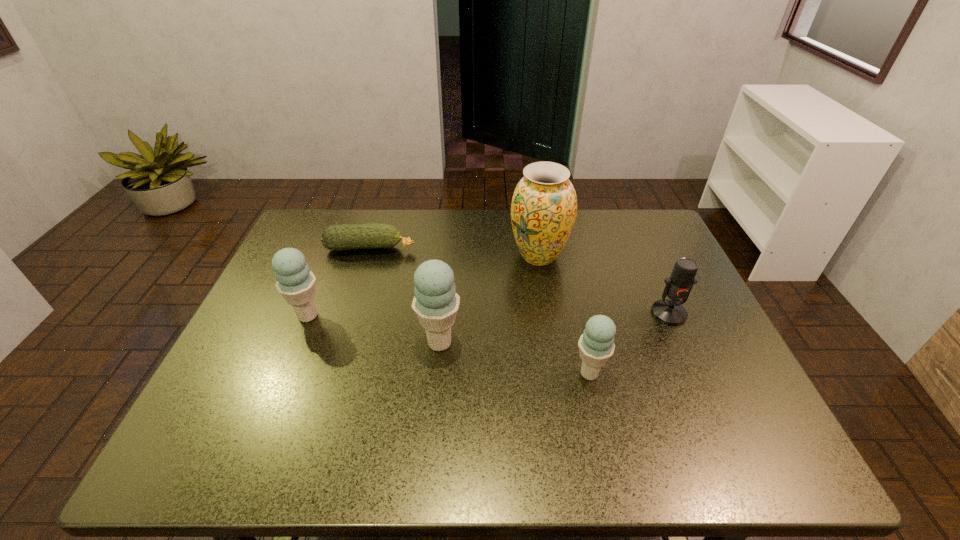
Identify the location of free point that keeps the ice creams evenly spaced on the right. click(760, 408).